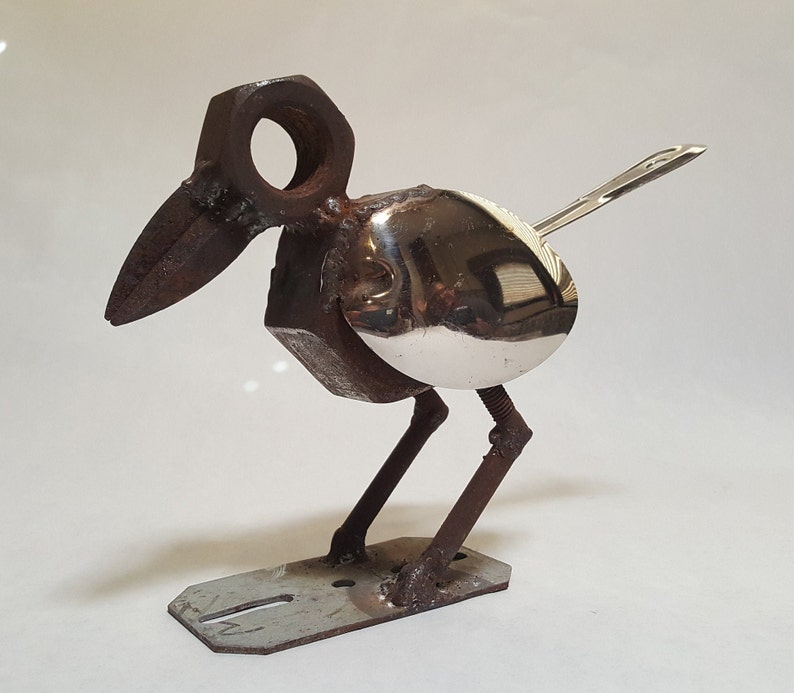
Locate an element on the screen. sculpture is located at coordinates tap(414, 322).